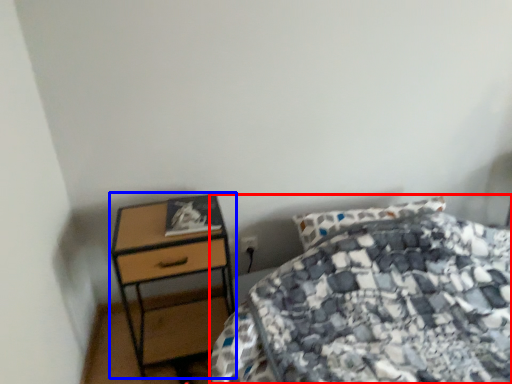
Question: Among these objects, which one is nearest to the camera, bed (highlighted by a red box) or nightstand (highlighted by a blue box)?

Choices:
 (A) bed
 (B) nightstand

Answer: (A)